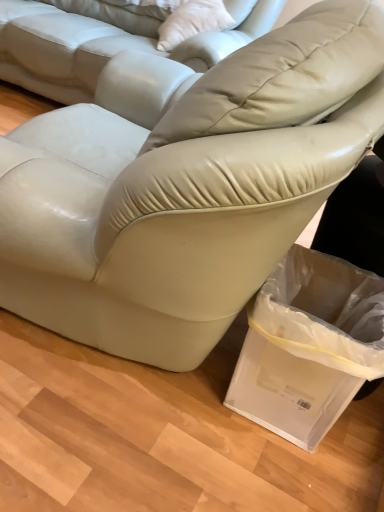
Question: Considering the relative positions of satin beige leather couch at center, acting as the first studio couch starting from the top, and clear plastic bag at lower right in the image provided, is satin beige leather couch at center, acting as the first studio couch starting from the top, to the left of clear plastic bag at lower right from the viewer's perspective?

Choices:
 (A) no
 (B) yes

Answer: (B)

Question: Is satin beige leather couch at center, which is the second studio couch in bottom-to-top order, turned away from clear plastic bag at lower right?

Choices:
 (A) yes
 (B) no

Answer: (B)

Question: Is satin beige leather couch at center, which is the second studio couch in bottom-to-top order, oriented towards clear plastic bag at lower right?

Choices:
 (A) yes
 (B) no

Answer: (B)

Question: Does satin beige leather couch at center, which is the second studio couch in bottom-to-top order, appear on the right side of clear plastic bag at lower right?

Choices:
 (A) yes
 (B) no

Answer: (B)

Question: Can you confirm if satin beige leather couch at center, acting as the first studio couch starting from the top, is taller than clear plastic bag at lower right?

Choices:
 (A) yes
 (B) no

Answer: (A)

Question: Is clear plastic bag at lower right surrounded by satin beige leather couch at center, acting as the first studio couch starting from the top?

Choices:
 (A) no
 (B) yes

Answer: (A)

Question: From the image's perspective, is white leather pillow at upper center under clear plastic bag at lower right?

Choices:
 (A) yes
 (B) no

Answer: (B)

Question: Is white leather pillow at upper center turned away from clear plastic bag at lower right?

Choices:
 (A) yes
 (B) no

Answer: (B)

Question: Does white leather pillow at upper center come behind clear plastic bag at lower right?

Choices:
 (A) no
 (B) yes

Answer: (B)

Question: Can clear plastic bag at lower right be found inside white leather pillow at upper center?

Choices:
 (A) no
 (B) yes

Answer: (A)

Question: Is white leather pillow at upper center aimed at clear plastic bag at lower right?

Choices:
 (A) yes
 (B) no

Answer: (B)

Question: Can you confirm if white leather pillow at upper center is shorter than clear plastic bag at lower right?

Choices:
 (A) no
 (B) yes

Answer: (B)

Question: From the image's perspective, does clear plastic bag at lower right appear higher than matte leather couch at center, positioned as the first studio couch in bottom-to-top order?

Choices:
 (A) no
 (B) yes

Answer: (A)